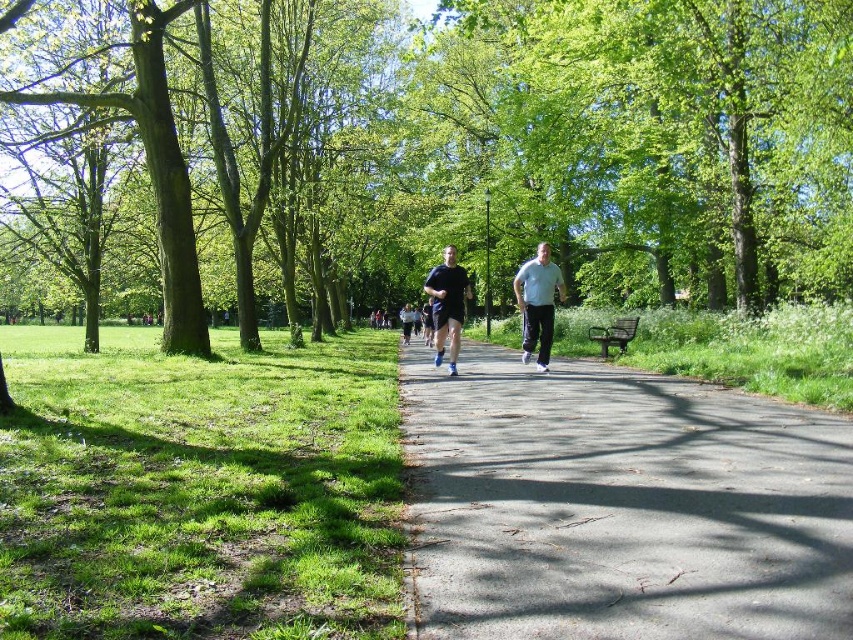
You are a GUI agent. You are given a task and a screenshot of the screen. Output one action in this format:
    pyautogui.click(x=<x>, y=<y>)
    Task: Click on the asphalt path at center
    
    Given the screenshot: What is the action you would take?
    coord(619,506)

Does asphalt path at center appear on the left side of dark blue fabric running shoe at center?

In fact, asphalt path at center is to the right of dark blue fabric running shoe at center.

Does point (663, 560) lie behind point (461, 317)?

No, (663, 560) is closer to viewer.

Identify the location of asphalt path at center. This screenshot has height=640, width=853. (619, 506).

Who is higher up, green leafy tree at center or light blue fabric shirt at center?

green leafy tree at center is above.

Who is positioned more to the left, green leafy tree at center or light blue fabric shirt at center?

Positioned to the left is green leafy tree at center.

Is point (335, 67) positioned in front of point (543, 353)?

No.

Locate an element on the screen. green leafy tree at center is located at coordinates (433, 147).

Can you confirm if asphalt path at center is positioned below light blue fabric shirt at center?

Correct, asphalt path at center is located below light blue fabric shirt at center.

Between asphalt path at center and light blue fabric shirt at center, which one has less height?

Standing shorter between the two is asphalt path at center.

Find the location of a particular element. asphalt path at center is located at coordinates (619, 506).

Where is `asphalt path at center`? The width and height of the screenshot is (853, 640). asphalt path at center is located at coordinates (619, 506).